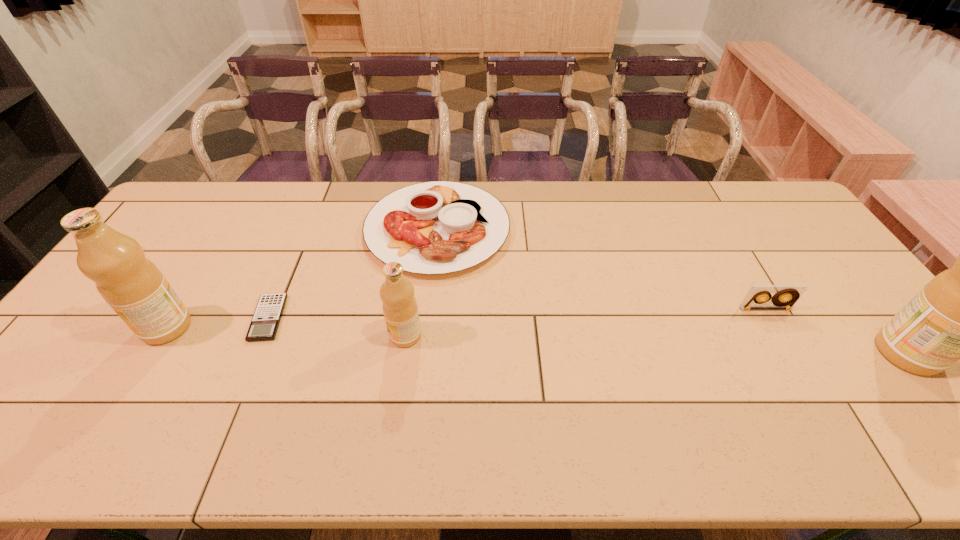
I want to click on the leftmost olive oil, so click(x=133, y=286).

At what (x,y) coordinates should I click in order to perform the action: click on the leftmost object. Please return your answer as a coordinate pair (x, y). Image resolution: width=960 pixels, height=540 pixels. Looking at the image, I should click on (133, 286).

What are the coordinates of `the third tallest object` in the screenshot? It's located at (400, 309).

This screenshot has width=960, height=540. I want to click on the shortest olive oil, so click(x=400, y=309).

Find the location of `the rightmost olive oil`. the rightmost olive oil is located at coordinates (958, 315).

Locate an element on the screen. platter is located at coordinates (437, 227).

At what (x,y) coordinates should I click in order to perform the action: click on the fifth tallest object. Please return your answer as a coordinate pair (x, y). The image size is (960, 540). Looking at the image, I should click on (437, 227).

At what (x,y) coordinates should I click in order to perform the action: click on the fourth tallest object. Please return your answer as a coordinate pair (x, y). The height and width of the screenshot is (540, 960). Looking at the image, I should click on (785, 297).

Identify the location of the second object from right to left. The width and height of the screenshot is (960, 540). (785, 297).

You are a GUI agent. You are given a task and a screenshot of the screen. Output one action in this format:
    pyautogui.click(x=<x>, y=<y>)
    Task: Click on the calculator
    This screenshot has height=540, width=960.
    Given the screenshot: What is the action you would take?
    pyautogui.click(x=265, y=322)